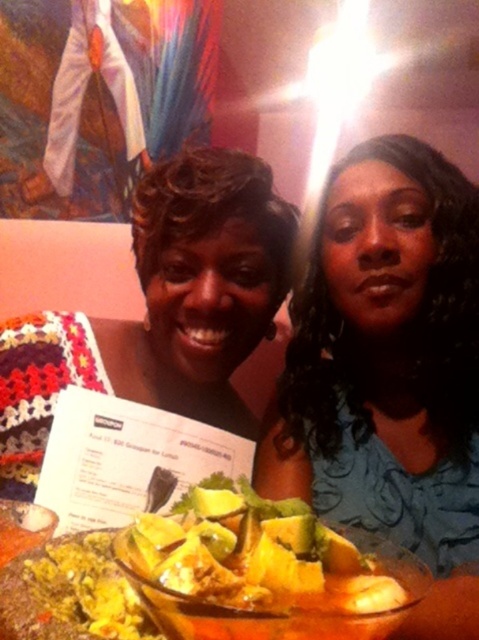
Question: Which point is farther to the camera?

Choices:
 (A) (348, 589)
 (B) (68, 524)
 (C) (171, 173)

Answer: (C)

Question: Among these objects, which one is nearest to the camera?

Choices:
 (A) yellowish tortilla chips at center
 (B) white paper menu at center
 (C) blue satin dress at center

Answer: (A)

Question: Is matte black sweater at center thinner than white paper menu at center?

Choices:
 (A) yes
 (B) no

Answer: (B)

Question: Considering the real-world distances, which object is closest to the matte black sweater at center?

Choices:
 (A) white paper menu at center
 (B) yellowish tortilla chips at center
 (C) blue satin dress at center

Answer: (A)

Question: Can you confirm if yellowish tortilla chips at center is bigger than white paper menu at center?

Choices:
 (A) yes
 (B) no

Answer: (B)

Question: Observing the image, what is the correct spatial positioning of blue satin dress at center in reference to white paper menu at center?

Choices:
 (A) above
 (B) below

Answer: (A)